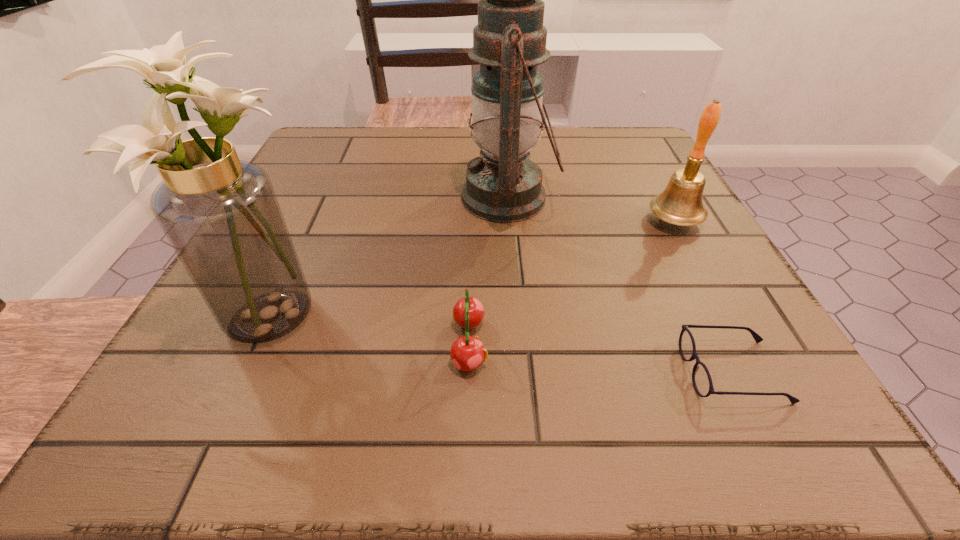
At what (x,y) coordinates should I click in order to perform the action: click on oil lamp. Please return your answer as a coordinate pair (x, y). The width and height of the screenshot is (960, 540). Looking at the image, I should click on (502, 185).

This screenshot has width=960, height=540. What are the coordinates of `the leftmost object` in the screenshot? It's located at (221, 215).

Identify the location of bell. (680, 203).

You are a GUI agent. You are given a task and a screenshot of the screen. Output one action in this format:
    pyautogui.click(x=<x>, y=<y>)
    Task: Click on the second shortest object
    Image resolution: width=960 pixels, height=540 pixels.
    Given the screenshot: What is the action you would take?
    pyautogui.click(x=467, y=353)

The image size is (960, 540). I want to click on the shortest object, so click(701, 378).

Where is `vacant area situated 0.230m on the left of the oil lamp`? Image resolution: width=960 pixels, height=540 pixels. vacant area situated 0.230m on the left of the oil lamp is located at coordinates (350, 198).

Where is `vacant space located 0.220m on the back of the flower arrangement`? vacant space located 0.220m on the back of the flower arrangement is located at coordinates (323, 199).

The width and height of the screenshot is (960, 540). What are the coordinates of `vacant space located on the back of the bell` in the screenshot? It's located at (649, 176).

I want to click on free location located with stems pointing upwards on the cherry, so click(557, 343).

Where is `free space located 0.270m on the front-facing side of the spectacles`? This screenshot has width=960, height=540. free space located 0.270m on the front-facing side of the spectacles is located at coordinates (490, 372).